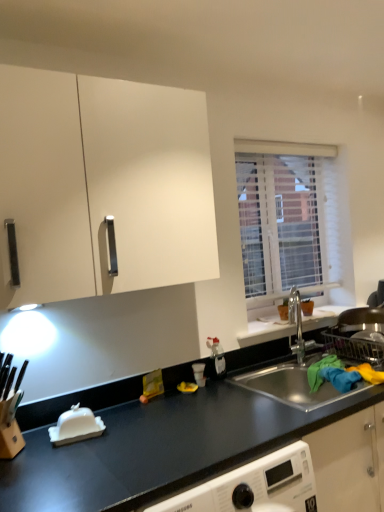
The image size is (384, 512). I want to click on free space above black matte countertop at center (from a real-world perspective), so click(173, 435).